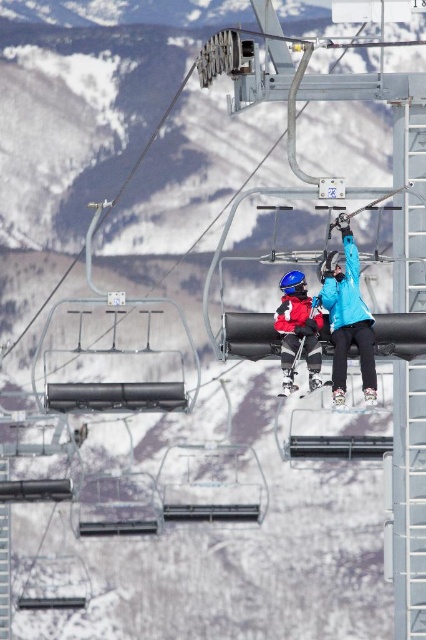
Question: Is blue matte jacket at upper center to the right of matte red ski suit at center from the viewer's perspective?

Choices:
 (A) yes
 (B) no

Answer: (A)

Question: Does blue matte jacket at upper center come in front of matte red ski suit at center?

Choices:
 (A) yes
 (B) no

Answer: (A)

Question: Which of the following is the farthest from the observer?

Choices:
 (A) (317, 314)
 (B) (330, 292)

Answer: (B)

Question: Is blue matte jacket at upper center wider than matte red ski suit at center?

Choices:
 (A) no
 (B) yes

Answer: (A)

Question: Which point is closer to the camera taking this photo?

Choices:
 (A) (317, 324)
 (B) (342, 365)

Answer: (B)

Question: Among these points, which one is nearest to the camera?

Choices:
 (A) (304, 324)
 (B) (348, 227)

Answer: (A)